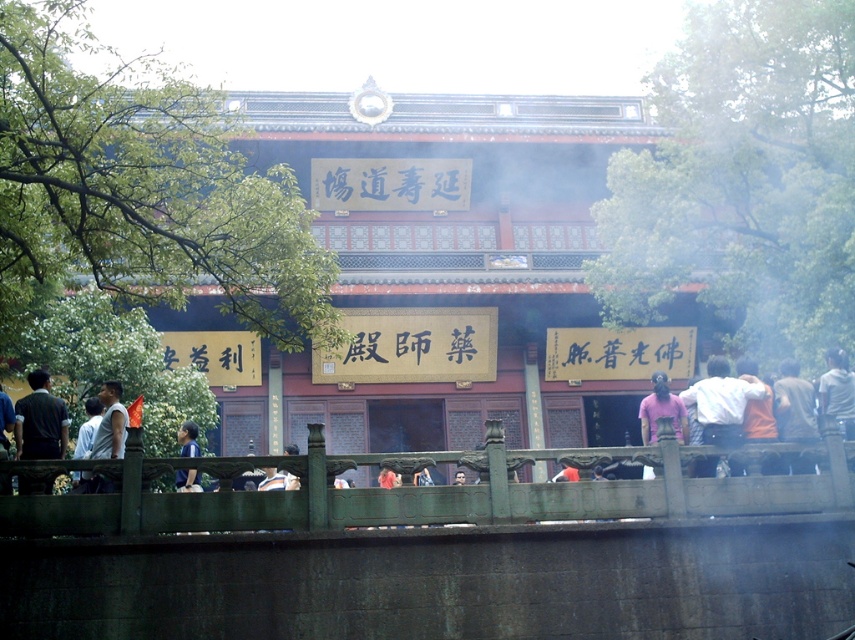
You are an event planner organizing a photo shoot in front of the traditional Chinese building. You need to position two props for the shoot. One is a pink fabric at right and the other is a blue shirt at lower left. The client wants to know which prop is wider. Which one should you choose?

The pink fabric at right is wider than the blue shirt at lower left, so you should choose the pink fabric at right as the wider prop.